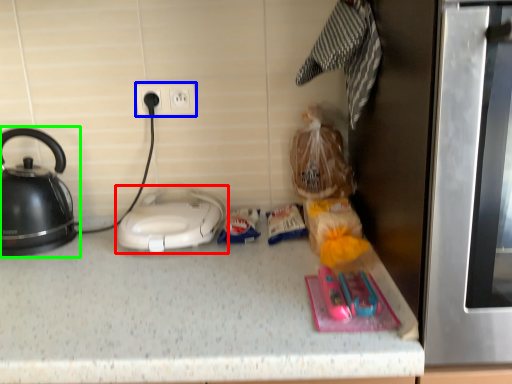
Question: Estimate the real-world distances between objects in this image. Which object is closer to home appliance (highlighted by a red box), electric outlet (highlighted by a blue box) or kettle (highlighted by a green box)?

Choices:
 (A) electric outlet
 (B) kettle

Answer: (B)